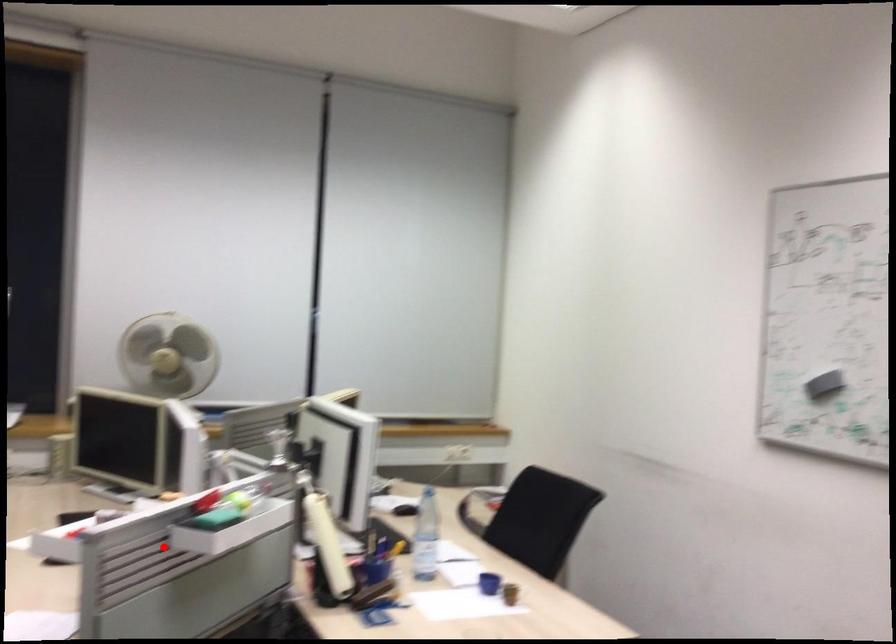
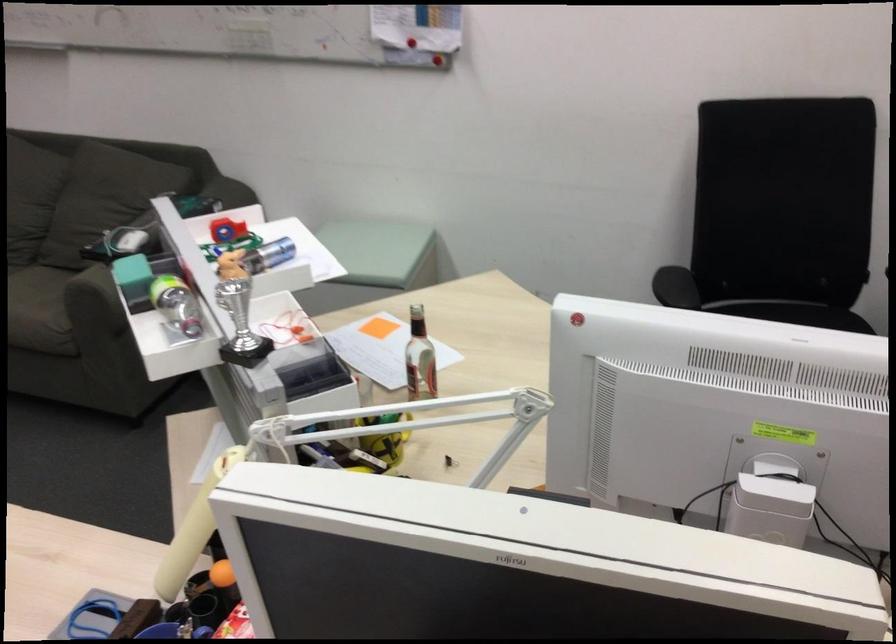
In the second image, find the point that corresponds to the highlighted location in the first image.

(240, 324)